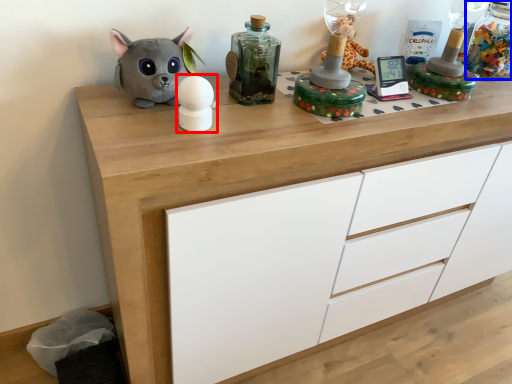
Question: Which of the following is the closest to the observer, toy (highlighted by a red box) or bottle (highlighted by a blue box)?

Choices:
 (A) toy
 (B) bottle

Answer: (A)